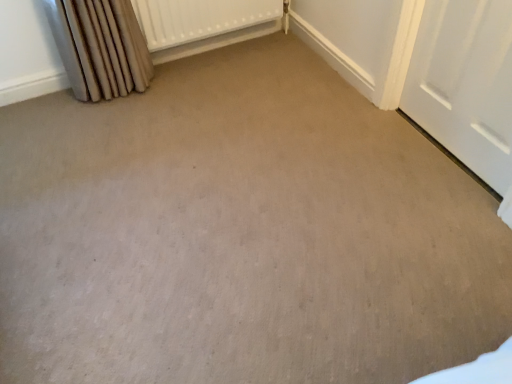
Locate an element on the screen. vacant space to the left of white matte door at right is located at coordinates (369, 149).